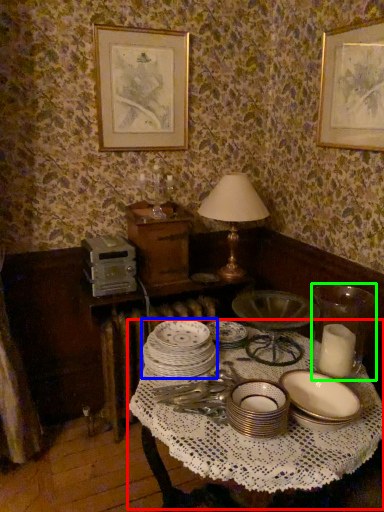
Question: Based on their relative distances, which object is farther from round table (highlighted by a red box)? Choose from tableware (highlighted by a blue box) and tableware (highlighted by a green box).

Choices:
 (A) tableware
 (B) tableware

Answer: (B)